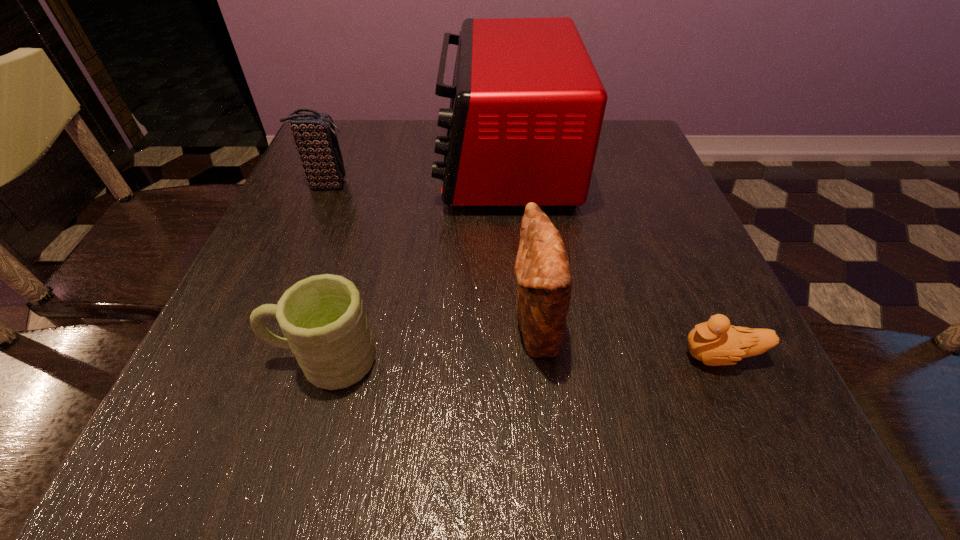
Identify the location of object that is at the right edge. The width and height of the screenshot is (960, 540). (715, 342).

I want to click on free space at the far edge of the desktop, so click(x=405, y=148).

Locate an element on the screen. The width and height of the screenshot is (960, 540). vacant point at the near edge is located at coordinates (614, 447).

The image size is (960, 540). I want to click on vacant space at the left edge of the desktop, so click(x=245, y=289).

Where is `free location at the right edge`? The width and height of the screenshot is (960, 540). free location at the right edge is located at coordinates (693, 318).

Where is `vacant space at the near left corner of the desktop`? vacant space at the near left corner of the desktop is located at coordinates (190, 441).

Locate an element on the screen. free region at the far right corner is located at coordinates (615, 155).

Locate an element on the screen. The image size is (960, 540). vacant space at the near right corner of the desktop is located at coordinates (758, 475).

You are a GUI agent. You are given a task and a screenshot of the screen. Output one action in this format:
    pyautogui.click(x=<x>, y=<y>)
    Task: Click on the blank region between the farther clutch bag and the tallest object
    
    Given the screenshot: What is the action you would take?
    pyautogui.click(x=416, y=173)

Identify the location of vacant region between the duckling and the right clutch bag. The image size is (960, 540). (628, 342).